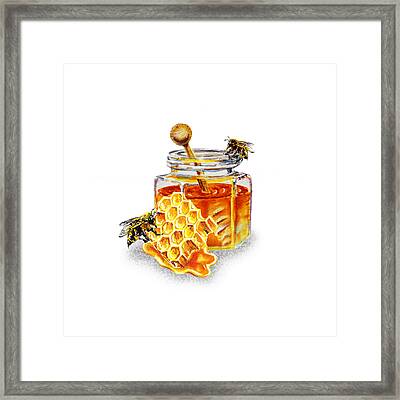
Locate an element on the screen. This screenshot has height=400, width=400. corners is located at coordinates tap(3, 395), tap(21, 379), tap(396, 395), tap(379, 377), tap(399, 1), tap(380, 17), tap(2, 1), tap(18, 20).